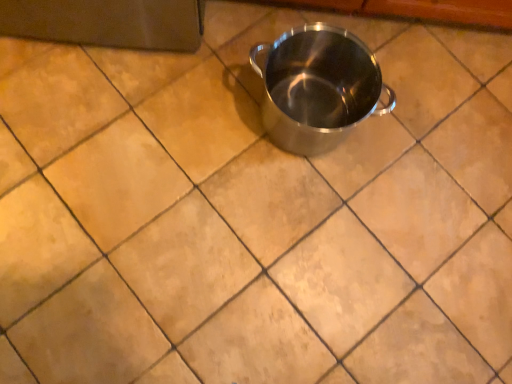
Identify the location of vacant region in front of shiny metallic pot at center. The height and width of the screenshot is (384, 512). (272, 216).